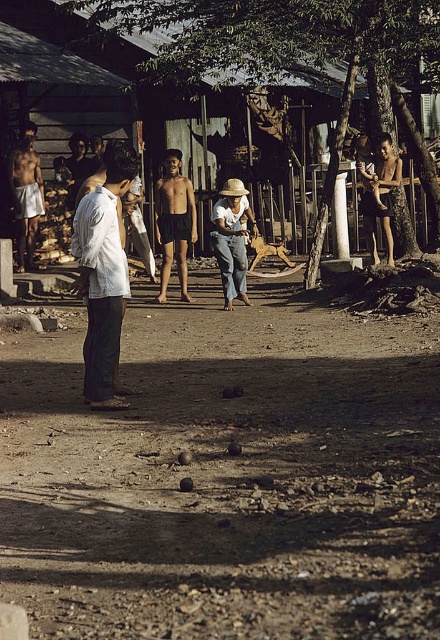
Measure the distance between light brown straw hat at center and matte white shorts at left.

A distance of 14.06 feet exists between light brown straw hat at center and matte white shorts at left.

Measure the distance between point (244, 205) and camera.

Point (244, 205) and camera are 11.88 meters apart from each other.

Identify the location of light brown straw hat at center. (231, 240).

Is brown dirt field at center to the left of white cotton shirt at left from the viewer's perspective?

Yes, brown dirt field at center is to the left of white cotton shirt at left.

Can you confirm if brown dirt field at center is wider than white cotton shirt at left?

Incorrect, brown dirt field at center's width does not surpass white cotton shirt at left's.

The height and width of the screenshot is (640, 440). Find the location of `brown dirt field at center`. brown dirt field at center is located at coordinates (227, 476).

Is point (11, 484) more distant than point (242, 269)?

That is False.

Looking at this image, is brown dirt field at center further to the viewer compared to light brown straw hat at center?

No, it is not.

Image resolution: width=440 pixels, height=640 pixels. Describe the element at coordinates (227, 476) in the screenshot. I see `brown dirt field at center` at that location.

Identify the location of brown dirt field at center. Image resolution: width=440 pixels, height=640 pixels. (227, 476).